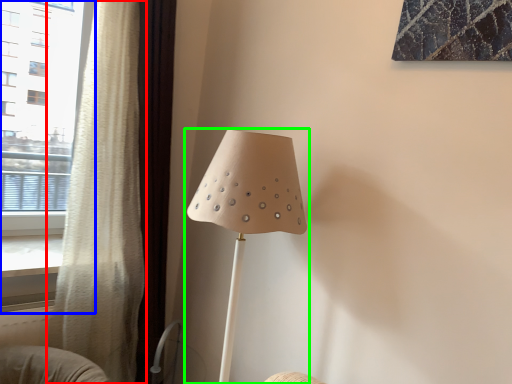
Question: Based on their relative distances, which object is farther from curtain (highlighted by a red box)? Choose from window (highlighted by a blue box) and lamp (highlighted by a green box).

Choices:
 (A) window
 (B) lamp

Answer: (A)